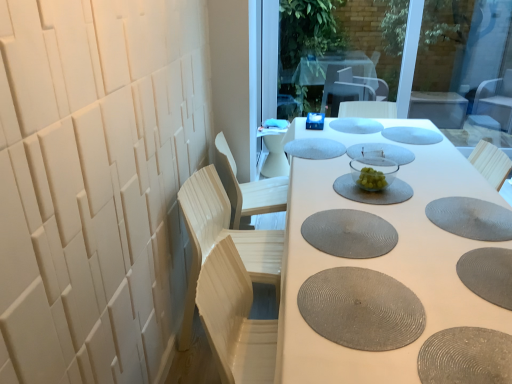
In order to click on free point behind gray textured placemat at center, which is the 2th manhole cover in front-to-back order in this screenshot , I will do `click(354, 253)`.